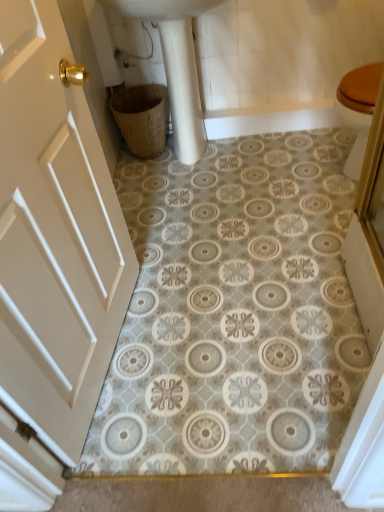
Find the location of a particular element. woven brown basket at lower left is located at coordinates click(141, 119).

Describe the element at coordinates (141, 119) in the screenshot. The width and height of the screenshot is (384, 512). I see `woven brown basket at lower left` at that location.

Describe the element at coordinates (177, 65) in the screenshot. This screenshot has width=384, height=512. I see `white glossy sink at upper center` at that location.

Locate an element on the screen. The image size is (384, 512). woven brown basket at lower left is located at coordinates (141, 119).

Could white matte door at left be considered to be inside white glossy sink at upper center?

That's incorrect, white matte door at left is not inside white glossy sink at upper center.

Is white glossy sink at upper center turned away from white matte door at left?

No, white matte door at left is not at the back of white glossy sink at upper center.

Considering the relative sizes of white glossy sink at upper center and white matte door at left in the image provided, is white glossy sink at upper center wider than white matte door at left?

Correct, the width of white glossy sink at upper center exceeds that of white matte door at left.

In terms of height, does white glossy sink at upper center look taller or shorter compared to white matte door at left?

white glossy sink at upper center is shorter than white matte door at left.

Is woven brown basket at lower left to the left or to the right of white matte door at left in the image?

Based on their positions, woven brown basket at lower left is located to the right of white matte door at left.

How many degrees apart are the facing directions of woven brown basket at lower left and white matte door at left?

The angular difference between woven brown basket at lower left and white matte door at left is 81.9 degrees.

Who is shorter, woven brown basket at lower left or white matte door at left?

With less height is woven brown basket at lower left.

The width and height of the screenshot is (384, 512). I want to click on door in front of the woven brown basket at lower left, so click(54, 236).

Can you tell me how much woven brown basket at lower left and white glossy sink at upper center differ in facing direction?

0.000372 degrees separate the facing orientations of woven brown basket at lower left and white glossy sink at upper center.

Between point (154, 97) and point (175, 144), which one is positioned in front?

The point (154, 97) is in front.

Is the depth of woven brown basket at lower left greater than that of white glossy sink at upper center?

Yes.

Does woven brown basket at lower left appear on the left side of white glossy sink at upper center?

Yes, woven brown basket at lower left is to the left of white glossy sink at upper center.

Can we say white glossy sink at upper center lies outside woven brown basket at lower left?

Indeed, white glossy sink at upper center is completely outside woven brown basket at lower left.

From a real-world perspective, which object stands above the other?

From a 3D spatial view, white glossy sink at upper center is above.

Which is in front, white matte door at left or woven brown basket at lower left?

white matte door at left.

How many degrees apart are the facing directions of white matte door at left and woven brown basket at lower left?

The angle between the facing direction of white matte door at left and the facing direction of woven brown basket at lower left is 81.9 degrees.

From the image's perspective, is white matte door at left above or below woven brown basket at lower left?

From the image's perspective, white matte door at left appears below woven brown basket at lower left.

Is point (10, 312) behind point (192, 100)?

No.

Can you tell me how much white matte door at left and white glossy sink at upper center differ in facing direction?

81.9 degrees.

Does white matte door at left come behind white glossy sink at upper center?

No, white matte door at left is closer to the camera.

Are white matte door at left and white glossy sink at upper center beside each other?

No, white matte door at left is not beside white glossy sink at upper center.

The height and width of the screenshot is (512, 384). What are the coordinates of `door on the left of white glossy sink at upper center` in the screenshot? It's located at (54, 236).

The image size is (384, 512). I want to click on basket located on the right of white matte door at left, so click(x=141, y=119).

Based on their spatial positions, is white matte door at left or white glossy sink at upper center closer to woven brown basket at lower left?

white glossy sink at upper center is positioned closer to the anchor woven brown basket at lower left.

When comparing their distances from white matte door at left, does woven brown basket at lower left or white glossy sink at upper center seem further?

Among the two, woven brown basket at lower left is located further to white matte door at left.

Considering their positions, is white glossy sink at upper center positioned closer to white matte door at left than woven brown basket at lower left?

The object closer to white matte door at left is white glossy sink at upper center.

Considering their positions, is woven brown basket at lower left positioned closer to white glossy sink at upper center than white matte door at left?

Based on the image, woven brown basket at lower left appears to be nearer to white glossy sink at upper center.

Based on their spatial positions, is white matte door at left or woven brown basket at lower left closer to white glossy sink at upper center?

woven brown basket at lower left is positioned closer to the anchor white glossy sink at upper center.

Considering their positions, is white glossy sink at upper center positioned further to woven brown basket at lower left than white matte door at left?

white matte door at left lies further to woven brown basket at lower left than the other object.

Where is `sink located between white matte door at left and woven brown basket at lower left in the depth direction`? sink located between white matte door at left and woven brown basket at lower left in the depth direction is located at coordinates (177, 65).